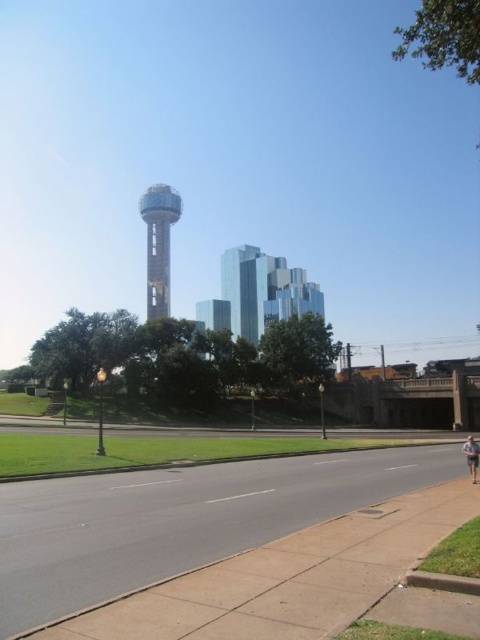
Question: Estimate the real-world distances between objects in this image. Which object is closer to the light brown shorts at lower right?

Choices:
 (A) metallic silver water tower at center
 (B) gray concrete sidewalk at lower center

Answer: (B)

Question: Among these points, which one is farthest from the camera?

Choices:
 (A) [x=148, y=212]
 (B) [x=468, y=442]

Answer: (A)

Question: Does gray concrete sidewalk at lower center appear on the left side of metallic silver water tower at center?

Choices:
 (A) yes
 (B) no

Answer: (B)

Question: Which object appears farthest from the camera in this image?

Choices:
 (A) light brown shorts at lower right
 (B) metallic silver water tower at center

Answer: (B)

Question: Does metallic silver water tower at center come in front of light brown shorts at lower right?

Choices:
 (A) yes
 (B) no

Answer: (B)

Question: Does gray concrete sidewalk at lower center have a greater width compared to light brown shorts at lower right?

Choices:
 (A) yes
 (B) no

Answer: (A)